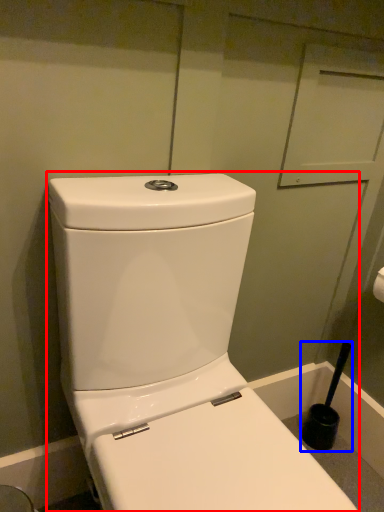
Question: Which object appears farthest to the camera in this image, toilet (highlighted by a red box) or brush (highlighted by a blue box)?

Choices:
 (A) toilet
 (B) brush

Answer: (B)